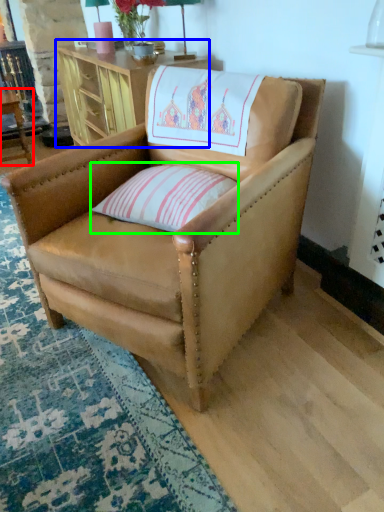
Question: Considering the real-world distances, which object is closest to table (highlighted by a red box)? table (highlighted by a blue box) or pillow (highlighted by a green box).

Choices:
 (A) table
 (B) pillow

Answer: (A)